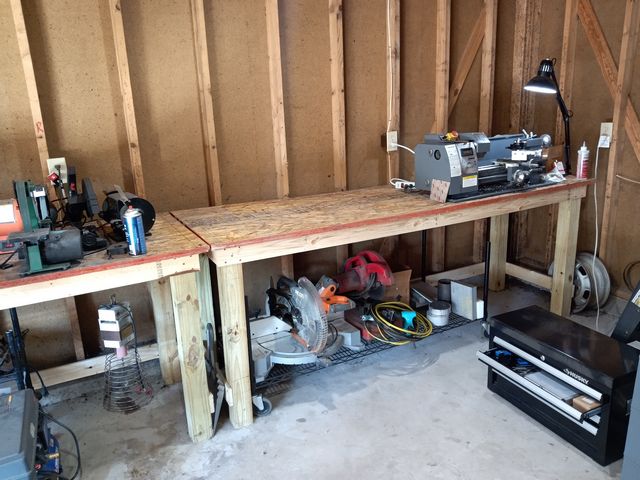
The height and width of the screenshot is (480, 640). Identify the location of wooden wall studs. (132, 121), (209, 117), (278, 109), (342, 99), (394, 96), (566, 71), (523, 70), (490, 77), (443, 88), (40, 120).